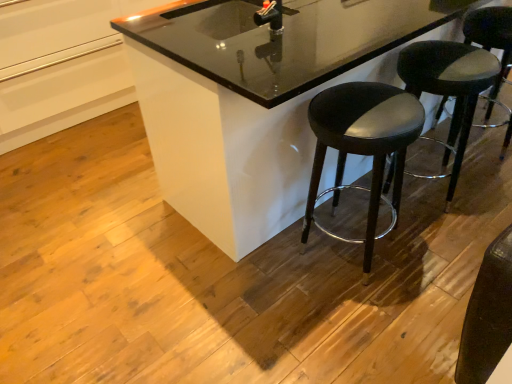
The height and width of the screenshot is (384, 512). Describe the element at coordinates (449, 89) in the screenshot. I see `black leather stool at lower right, which is the 2th stool in left-to-right order` at that location.

What is the approximate width of black leather stool at right, placed as the first stool when sorted from right to left?

black leather stool at right, placed as the first stool when sorted from right to left, is 15.51 inches wide.

What do you see at coordinates (362, 146) in the screenshot? This screenshot has width=512, height=384. I see `black leather stool at center, the first stool in the left-to-right sequence` at bounding box center [362, 146].

The width and height of the screenshot is (512, 384). Find the location of `black leather stool at lower right, which is the 2th stool in left-to-right order`. black leather stool at lower right, which is the 2th stool in left-to-right order is located at coordinates (449, 89).

From the image's perspective, is black leather stool at right, which is counted as the 3th stool, starting from the left, beneath black glossy sink at upper center?

Correct, black leather stool at right, which is counted as the 3th stool, starting from the left, appears lower than black glossy sink at upper center in the image.

Which is behind, point (509, 26) or point (259, 24)?

The point (509, 26) is farther.

Is black leather stool at right, placed as the first stool when sorted from right to left, inside or outside of black glossy sink at upper center?

black leather stool at right, placed as the first stool when sorted from right to left, is not enclosed by black glossy sink at upper center.

Are black leather stool at center, the first stool in the left-to-right sequence, and black leather stool at right, placed as the first stool when sorted from right to left, beside each other?

There is a gap between black leather stool at center, the first stool in the left-to-right sequence, and black leather stool at right, placed as the first stool when sorted from right to left.

Which is in front, point (355, 149) or point (507, 140)?

The point (355, 149) is closer.

Identify the location of the 1st stool in front of the black leather stool at right, placed as the first stool when sorted from right to left, counting from the anchor's position. The width and height of the screenshot is (512, 384). 449,89.

From a real-world perspective, is black leather stool at right, which is counted as the 3th stool, starting from the left, on black leather stool at lower right, which is the second stool from right to left?

No, from a real-world perspective, black leather stool at right, which is counted as the 3th stool, starting from the left, is not on top of black leather stool at lower right, which is the second stool from right to left.

Considering the positions of objects black leather stool at right, which is counted as the 3th stool, starting from the left, and black leather stool at lower right, which is the second stool from right to left, in the image provided, who is more to the right, black leather stool at right, which is counted as the 3th stool, starting from the left, or black leather stool at lower right, which is the second stool from right to left,?

black leather stool at right, which is counted as the 3th stool, starting from the left, is more to the right.

Which of these two, black leather stool at right, which is counted as the 3th stool, starting from the left, or black leather stool at lower right, which is the second stool from right to left, is bigger?

With larger size is black leather stool at lower right, which is the second stool from right to left.

Who is shorter, black glossy counter at center or black leather stool at center, the first stool in the left-to-right sequence?

With less height is black leather stool at center, the first stool in the left-to-right sequence.

In the scene shown: Is black glossy counter at center facing towards black leather stool at center, which is the 3th stool in right-to-left order?

No, black glossy counter at center is not facing towards black leather stool at center, which is the 3th stool in right-to-left order.

Locate an element on the screen. counter in front of the black leather stool at center, which is the 3th stool in right-to-left order is located at coordinates point(248,105).

Is black leather stool at lower right, which is the 2th stool in left-to-right order, surrounding black glossy sink at upper center?

No, black leather stool at lower right, which is the 2th stool in left-to-right order, does not contain black glossy sink at upper center.

Based on their positions, is black leather stool at lower right, which is the second stool from right to left, located to the left or right of black glossy sink at upper center?

From the image, it's evident that black leather stool at lower right, which is the second stool from right to left, is to the right of black glossy sink at upper center.

Does point (456, 55) come closer to viewer compared to point (272, 11)?

No.

Is black leather stool at right, which is counted as the 3th stool, starting from the left, inside or outside of black glossy counter at center?

black leather stool at right, which is counted as the 3th stool, starting from the left, is located inside black glossy counter at center.

Does point (496, 98) appear closer or farther from the camera than point (286, 166)?

Point (496, 98) is farther from the camera than point (286, 166).

Considering the sizes of objects black leather stool at right, placed as the first stool when sorted from right to left, and black glossy counter at center in the image provided, who is shorter, black leather stool at right, placed as the first stool when sorted from right to left, or black glossy counter at center?

black leather stool at right, placed as the first stool when sorted from right to left, is shorter.

Is black leather stool at right, placed as the first stool when sorted from right to left, looking in the opposite direction of black glossy counter at center?

Yes, black leather stool at right, placed as the first stool when sorted from right to left,'s orientation is away from black glossy counter at center.

How many degrees apart are the facing directions of black leather stool at lower right, which is the second stool from right to left, and black leather stool at center, which is the 3th stool in right-to-left order?

The facing directions of black leather stool at lower right, which is the second stool from right to left, and black leather stool at center, which is the 3th stool in right-to-left order, are 4e-06 degrees apart.

Does black leather stool at lower right, which is the 2th stool in left-to-right order, come in front of black leather stool at center, the first stool in the left-to-right sequence?

No, it is not.

Is black leather stool at lower right, which is the second stool from right to left, bigger than black leather stool at center, which is the 3th stool in right-to-left order?

Yes, black leather stool at lower right, which is the second stool from right to left, is bigger than black leather stool at center, which is the 3th stool in right-to-left order.

From the image's perspective, who appears lower, black leather stool at lower right, which is the second stool from right to left, or black leather stool at center, the first stool in the left-to-right sequence?

black leather stool at center, the first stool in the left-to-right sequence, from the image's perspective.

The height and width of the screenshot is (384, 512). Find the location of `sink above the black leather stool at right, which is counted as the 3th stool, starting from the left (from the image's perspective)`. sink above the black leather stool at right, which is counted as the 3th stool, starting from the left (from the image's perspective) is located at coordinates (238, 16).

Which stool is the 2nd one when counting from the back of the black leather stool at center, the first stool in the left-to-right sequence? Please provide its 2D coordinates.

[(490, 42)]

When comparing their distances from black glossy sink at upper center, does black leather stool at right, placed as the first stool when sorted from right to left, or black leather stool at center, which is the 3th stool in right-to-left order, seem closer?

black leather stool at right, placed as the first stool when sorted from right to left, lies closer to black glossy sink at upper center than the other object.

When comparing their distances from black leather stool at right, placed as the first stool when sorted from right to left, does black glossy counter at center or black leather stool at center, which is the 3th stool in right-to-left order, seem further?

Among the two, black glossy counter at center is located further to black leather stool at right, placed as the first stool when sorted from right to left.

Which object lies further to the anchor point black glossy counter at center, black leather stool at right, placed as the first stool when sorted from right to left, or black leather stool at lower right, which is the 2th stool in left-to-right order?

black leather stool at right, placed as the first stool when sorted from right to left, is positioned further to the anchor black glossy counter at center.

Based on their spatial positions, is black leather stool at right, which is counted as the 3th stool, starting from the left, or black glossy sink at upper center closer to black leather stool at lower right, which is the second stool from right to left?

black leather stool at right, which is counted as the 3th stool, starting from the left, lies closer to black leather stool at lower right, which is the second stool from right to left, than the other object.

When comparing their distances from black leather stool at right, placed as the first stool when sorted from right to left, does black leather stool at center, which is the 3th stool in right-to-left order, or black leather stool at lower right, which is the 2th stool in left-to-right order, seem closer?

The object closer to black leather stool at right, placed as the first stool when sorted from right to left, is black leather stool at lower right, which is the 2th stool in left-to-right order.

From the image, which object appears to be farther from black leather stool at lower right, which is the second stool from right to left, black glossy counter at center or black leather stool at center, the first stool in the left-to-right sequence?

Among the two, black glossy counter at center is located further to black leather stool at lower right, which is the second stool from right to left.

When comparing their distances from black leather stool at center, the first stool in the left-to-right sequence, does black leather stool at right, placed as the first stool when sorted from right to left, or black glossy sink at upper center seem closer?

Among the two, black leather stool at right, placed as the first stool when sorted from right to left, is located nearer to black leather stool at center, the first stool in the left-to-right sequence.

In the scene shown: Looking at the image, which one is located closer to black leather stool at center, which is the 3th stool in right-to-left order, black leather stool at lower right, which is the 2th stool in left-to-right order, or black glossy sink at upper center?

black leather stool at lower right, which is the 2th stool in left-to-right order, is positioned closer to the anchor black leather stool at center, which is the 3th stool in right-to-left order.

You are a GUI agent. You are given a task and a screenshot of the screen. Output one action in this format:
    pyautogui.click(x=<x>, y=<y>)
    Task: Click on the counter situated between black glossy sink at upper center and black leather stool at right, placed as the first stool when sorted from right to left, from left to right
    This screenshot has height=384, width=512.
    Given the screenshot: What is the action you would take?
    pyautogui.click(x=248, y=105)

This screenshot has height=384, width=512. Identify the location of stool situated between black glossy sink at upper center and black leather stool at lower right, which is the second stool from right to left, from left to right. (362, 146).

This screenshot has height=384, width=512. Find the location of `counter between black leather stool at center, which is the 3th stool in right-to-left order, and black leather stool at right, placed as the first stool when sorted from right to left`. counter between black leather stool at center, which is the 3th stool in right-to-left order, and black leather stool at right, placed as the first stool when sorted from right to left is located at coordinates (248, 105).

The image size is (512, 384). Find the location of `stool situated between black leather stool at center, the first stool in the left-to-right sequence, and black leather stool at right, which is counted as the 3th stool, starting from the left, from left to right`. stool situated between black leather stool at center, the first stool in the left-to-right sequence, and black leather stool at right, which is counted as the 3th stool, starting from the left, from left to right is located at coordinates 449,89.